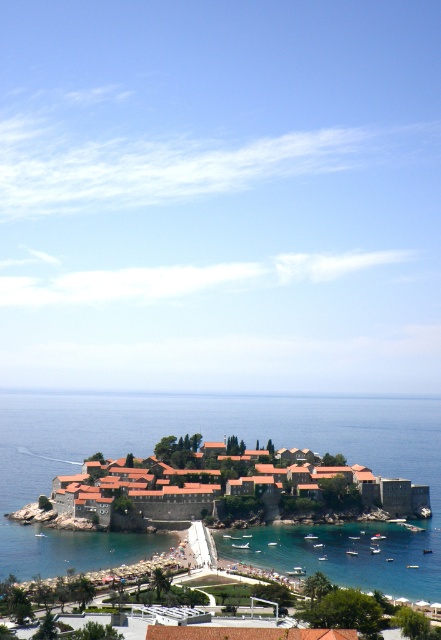
You are a visitor on the beach and want to swim to the island. You see the blue water at center and the clear blue water at lower center. Which body of water should you choose to swim through to reach the island first?

You should choose the clear blue water at lower center because it is located above the blue water at center, making it closer to the beach and the starting point for your swim.

You are a drone operator tasked with capturing aerial footage of the terracotta tiled roofs at center. The drone must maintain a minimum altitude of 50 meters to avoid disturbing the area. Given the coordinates provided, can you confirm if the drone will be able to capture the roofs without violating the altitude restriction?

The terracotta tiled roofs at center are located at coordinates point (138, 492). Since the drone must maintain a minimum altitude of 50 meters, it will be able to capture the roofs without violating the altitude restriction as long as the flight path is planned accordingly.

You are standing on the mainland looking at the coastal scene. There is a point marked at coordinates (216, 440). Based on the scene description, what does this point most likely represent?

The point at (216, 440) corresponds to blue water at center.